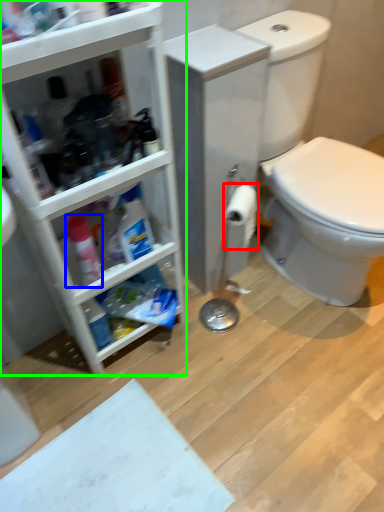
Question: Which is farther away from toilet paper (highlighted by a red box)? cleaning product (highlighted by a blue box) or bathroom cabinet (highlighted by a green box)?

Choices:
 (A) cleaning product
 (B) bathroom cabinet

Answer: (A)